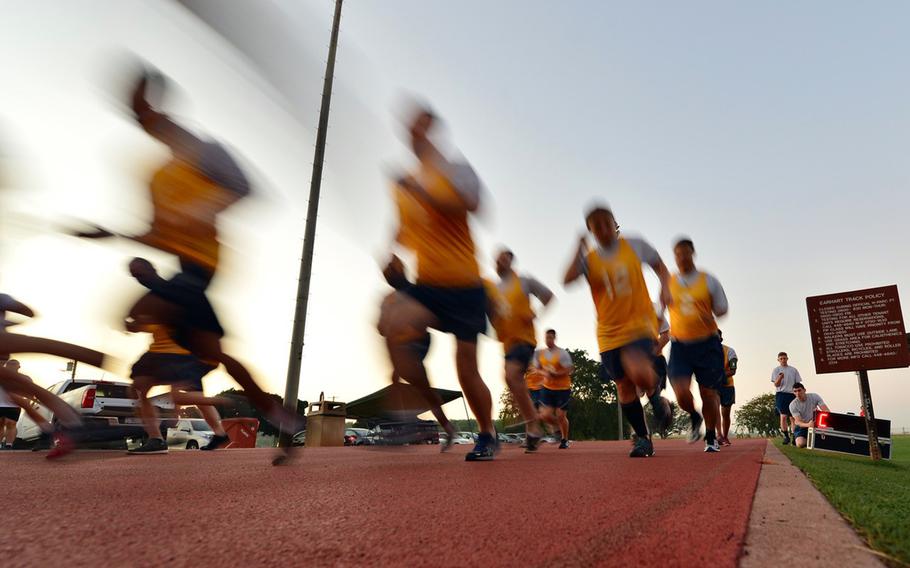
Where is `garbage can`? The image size is (910, 568). garbage can is located at coordinates (325, 427).